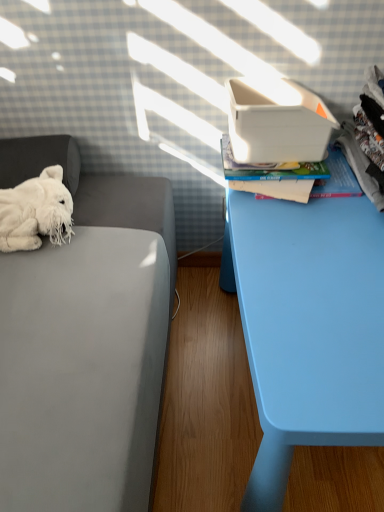
At what (x,y) coordinates should I click in order to perform the action: click on free space above light blue plastic table at right (from a real-world perspective). Please return your answer as a coordinate pair (x, y). This screenshot has height=512, width=384. Looking at the image, I should click on (324, 254).